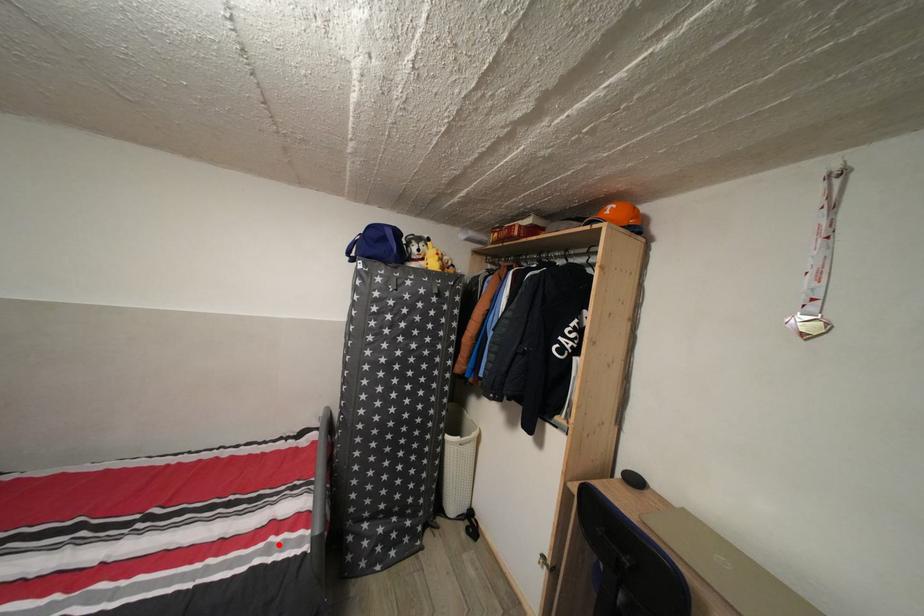
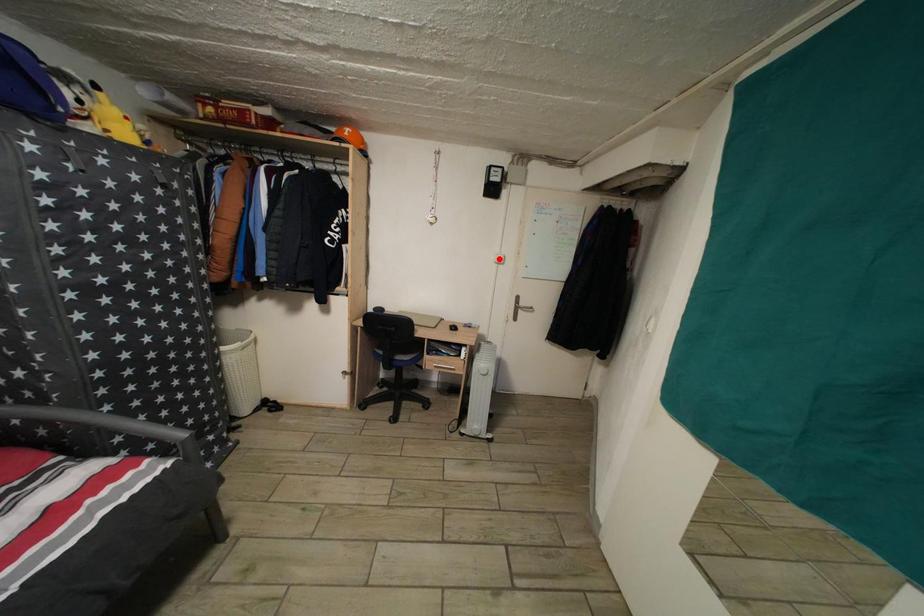
I am providing you with two images of the same scene from different viewpoints. A red point is marked on the first image and another point is marked on the second image. Are the points marked in image1 and image2 representing the same 3D position?

No